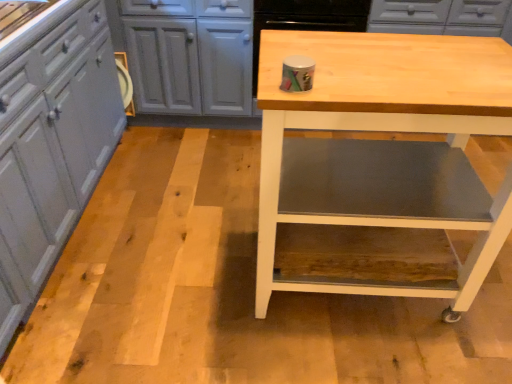
What do you see at coordinates (52, 149) in the screenshot?
I see `matte gray cabinets at left` at bounding box center [52, 149].

Find the location of a particular element. Image resolution: width=512 pixels, height=384 pixels. matte gray cabinets at left is located at coordinates (52, 149).

You are a GUI agent. You are given a task and a screenshot of the screen. Output one action in this format:
    pyautogui.click(x=<x>, y=<y>)
    Task: Click on the natural wood table at center
    
    Given the screenshot: What is the action you would take?
    pyautogui.click(x=383, y=149)

The height and width of the screenshot is (384, 512). What do you see at coordinates (383, 149) in the screenshot?
I see `natural wood table at center` at bounding box center [383, 149].

Image resolution: width=512 pixels, height=384 pixels. What are the coordinates of `matte gray cabinets at left` in the screenshot? It's located at point(52,149).

Which object is positioned more to the right, natural wood table at center or matte gray cabinets at left?

Positioned to the right is natural wood table at center.

Which object is further away from the camera taking this photo, natural wood table at center or matte gray cabinets at left?

natural wood table at center is further away from the camera.

Does point (400, 167) appear closer or farther from the camera than point (16, 254)?

Clearly, point (400, 167) is more distant from the camera than point (16, 254).

From the image's perspective, which one is positioned lower, natural wood table at center or matte gray cabinets at left?

natural wood table at center.

From a real-world perspective, relative to matte gray cabinets at left, is natural wood table at center vertically above or below?

natural wood table at center is situated higher than matte gray cabinets at left in the real world.

Considering the relative sizes of natural wood table at center and matte gray cabinets at left in the image provided, is natural wood table at center wider than matte gray cabinets at left?

No, natural wood table at center is not wider than matte gray cabinets at left.

Does natural wood table at center have a greater height compared to matte gray cabinets at left?

No, natural wood table at center is not taller than matte gray cabinets at left.

Is natural wood table at center smaller than matte gray cabinets at left?

Correct, natural wood table at center occupies less space than matte gray cabinets at left.

Would you say natural wood table at center is outside matte gray cabinets at left?

That's correct, natural wood table at center is outside of matte gray cabinets at left.

Are natural wood table at center and matte gray cabinets at left located far from each other?

That's right, there is a large distance between natural wood table at center and matte gray cabinets at left.

Is natural wood table at center facing towards matte gray cabinets at left?

No.

How different are the orientations of natural wood table at center and matte gray cabinets at left in degrees?

natural wood table at center and matte gray cabinets at left are facing 90.7 degrees away from each other.

You are a GUI agent. You are given a task and a screenshot of the screen. Output one action in this format:
    pyautogui.click(x=<x>, y=<y>)
    Task: Click on the cabinetry in front of the natural wood table at center
    The width and height of the screenshot is (512, 384).
    Given the screenshot: What is the action you would take?
    pyautogui.click(x=52, y=149)

Considering the positions of objects matte gray cabinets at left and natural wood table at center in the image provided, who is more to the right, matte gray cabinets at left or natural wood table at center?

natural wood table at center is more to the right.

Is the position of matte gray cabinets at left less distant than that of natural wood table at center?

Yes, the depth of matte gray cabinets at left is less than that of natural wood table at center.

Between point (94, 87) and point (433, 43), which one is positioned behind?

The point (94, 87) is farther.

From the image's perspective, does matte gray cabinets at left appear higher than natural wood table at center?

Indeed, from the image's perspective, matte gray cabinets at left is shown above natural wood table at center.

From a real-world perspective, which object stands above the other?

In real-world perspective, natural wood table at center is above.

Can you confirm if matte gray cabinets at left is wider than natural wood table at center?

Yes.

From the picture: Does matte gray cabinets at left have a greater height compared to natural wood table at center?

Correct, matte gray cabinets at left is much taller as natural wood table at center.

Who is smaller, matte gray cabinets at left or natural wood table at center?

With smaller size is natural wood table at center.

Is matte gray cabinets at left located outside natural wood table at center?

Yes, matte gray cabinets at left is located beyond the bounds of natural wood table at center.

Are matte gray cabinets at left and natural wood table at center making contact?

They are not placed beside each other.

Is matte gray cabinets at left looking in the opposite direction of natural wood table at center?

No, matte gray cabinets at left is not facing away from natural wood table at center.

In order to click on cabinetry in front of the natural wood table at center in this screenshot , I will do `click(52, 149)`.

Where is `table behind the matte gray cabinets at left`? The width and height of the screenshot is (512, 384). table behind the matte gray cabinets at left is located at coordinates (383, 149).

You are a GUI agent. You are given a task and a screenshot of the screen. Output one action in this format:
    pyautogui.click(x=<x>, y=<y>)
    Task: Click on the table below the matte gray cabinets at left (from the image's perspective)
    The height and width of the screenshot is (384, 512).
    Given the screenshot: What is the action you would take?
    pyautogui.click(x=383, y=149)